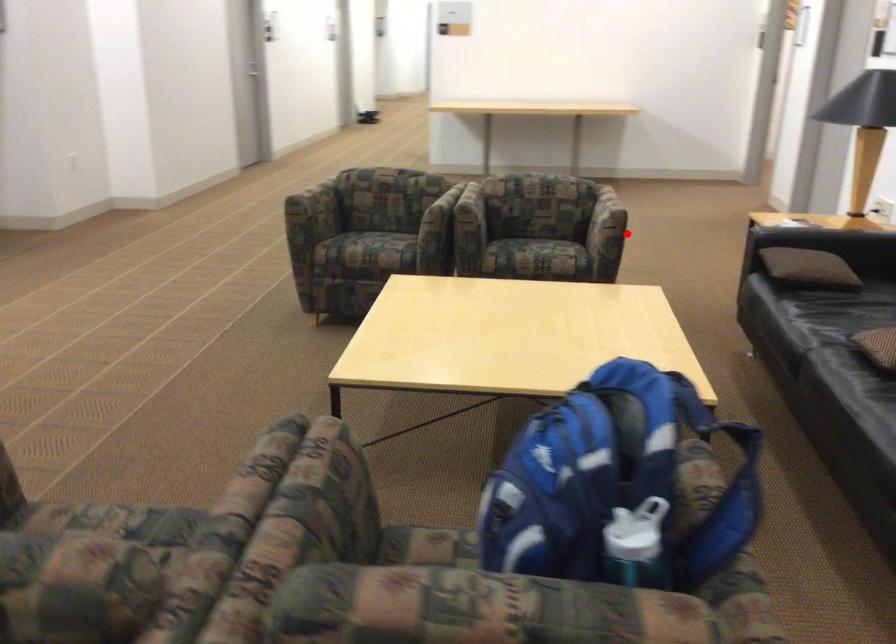
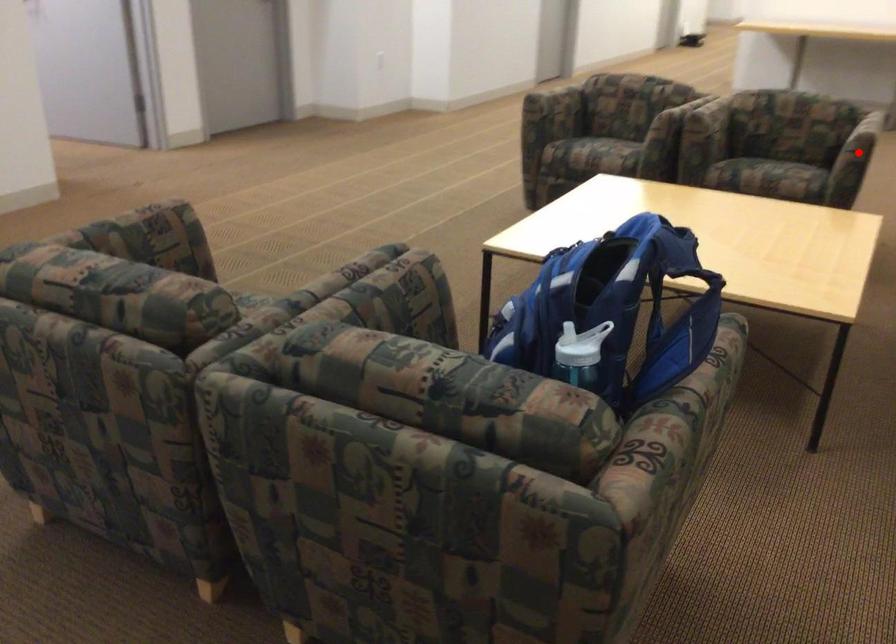
I am providing you with two images of the same scene from different viewpoints. A red point is marked on the first image and another point is marked on the second image. Is the red point in image1 aligned with the point shown in image2?

Yes